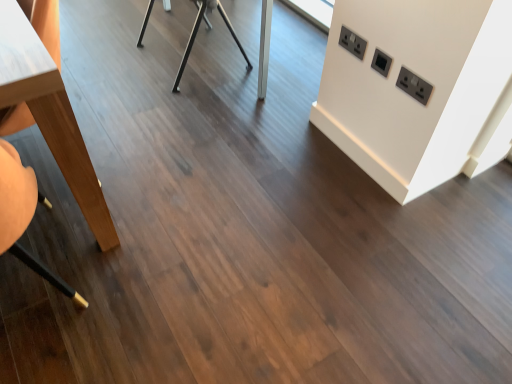
Locate an element on the screen. The image size is (512, 384). vacant area that lies to the right of light brown wood table at left, the 2th table viewed from the back is located at coordinates (165, 171).